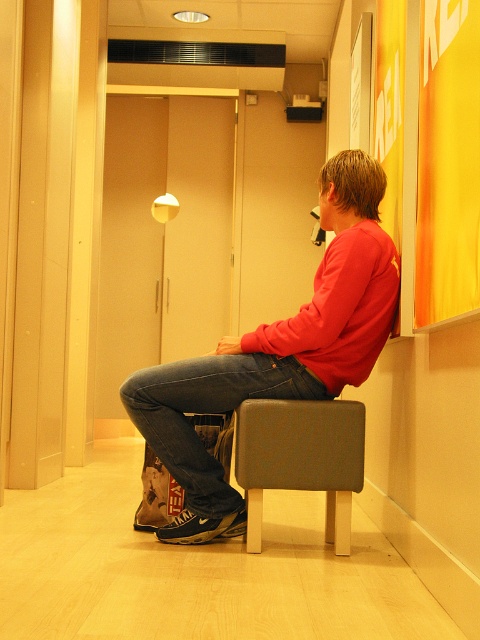
Between red matte sweater at center and leather-like gray stool at center, which one has more height?

With more height is red matte sweater at center.

Which is behind, point (126, 394) or point (243, 468)?

The point (126, 394) is more distant.

This screenshot has width=480, height=640. In order to click on red matte sweater at center in this screenshot , I will do `click(277, 352)`.

Between red matte sweater at center and denim at center, which one has less height?

With less height is denim at center.

In the scene shown: Who is more distant from viewer, (387, 262) or (176, 396)?

Positioned behind is point (176, 396).

Where is `red matte sweater at center`? This screenshot has width=480, height=640. red matte sweater at center is located at coordinates (277, 352).

Is the position of denim at center less distant than that of leather-like gray stool at center?

No, denim at center is behind leather-like gray stool at center.

This screenshot has height=640, width=480. Describe the element at coordinates (207, 412) in the screenshot. I see `denim at center` at that location.

The height and width of the screenshot is (640, 480). What do you see at coordinates (207, 412) in the screenshot?
I see `denim at center` at bounding box center [207, 412].

Where is `denim at center`? The image size is (480, 640). denim at center is located at coordinates (207, 412).